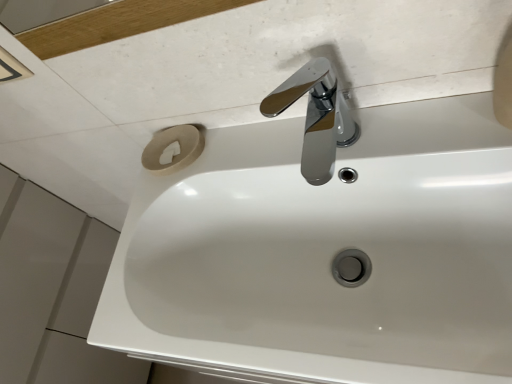
Question: Which is correct: chrome/metallic faucet at upper center is inside white glossy sink at center, or outside of it?

Choices:
 (A) inside
 (B) outside

Answer: (B)

Question: Does point (310, 137) appear closer or farther from the camera than point (414, 286)?

Choices:
 (A) closer
 (B) farther

Answer: (B)

Question: Would you say chrome/metallic faucet at upper center is to the left or to the right of white glossy sink at center in the picture?

Choices:
 (A) left
 (B) right

Answer: (B)

Question: From the image's perspective, is white glossy sink at center above or below chrome/metallic faucet at upper center?

Choices:
 (A) below
 (B) above

Answer: (A)

Question: Would you say white glossy sink at center is to the left or to the right of chrome/metallic faucet at upper center in the picture?

Choices:
 (A) right
 (B) left

Answer: (B)

Question: From a real-world perspective, is white glossy sink at center positioned above or below chrome/metallic faucet at upper center?

Choices:
 (A) above
 (B) below

Answer: (B)

Question: Is white glossy sink at center inside or outside of chrome/metallic faucet at upper center?

Choices:
 (A) inside
 (B) outside

Answer: (B)